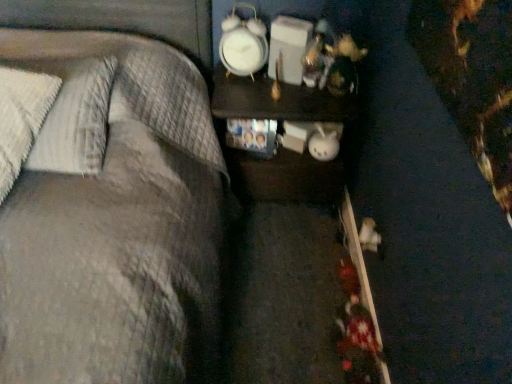
Find the location of a particular element. white plastic clock at upper center is located at coordinates (243, 44).

Image resolution: width=512 pixels, height=384 pixels. What do you see at coordinates (75, 118) in the screenshot? I see `white textured pillow at left` at bounding box center [75, 118].

You are a GUI agent. You are given a task and a screenshot of the screen. Output one action in this format:
    pyautogui.click(x=<x>, y=<y>)
    Task: Click on the white plastic clock at upper center
    
    Given the screenshot: What is the action you would take?
    pyautogui.click(x=243, y=44)

From the picture: Can we say white textured pillow at left lies outside white plastic clock at upper center?

white textured pillow at left lies outside white plastic clock at upper center's area.

Considering the relative sizes of white textured pillow at left and white plastic clock at upper center in the image provided, is white textured pillow at left bigger than white plastic clock at upper center?

Correct, white textured pillow at left is larger in size than white plastic clock at upper center.

I want to click on clock below the white textured pillow at left (from a real-world perspective), so click(243, 44).

Is dark wood nightstand at center further to the viewer compared to white textured pillow at left?

Yes, the depth of dark wood nightstand at center is greater than that of white textured pillow at left.

Can you tell me how much dark wood nightstand at center and white textured pillow at left differ in facing direction?

dark wood nightstand at center and white textured pillow at left are facing 2.61 degrees away from each other.

Between dark wood nightstand at center and white textured pillow at left, which one has less height?

Standing shorter between the two is white textured pillow at left.

Which of these two, dark wood nightstand at center or white textured pillow at left, is wider?

Wider between the two is white textured pillow at left.

Are white plastic clock at upper center and dark wood nightstand at center located far from each other?

white plastic clock at upper center is actually quite close to dark wood nightstand at center.

Based on the photo, is white plastic clock at upper center wider than dark wood nightstand at center?

No, white plastic clock at upper center is not wider than dark wood nightstand at center.

From the picture: From the image's perspective, is white plastic clock at upper center under dark wood nightstand at center?

Incorrect, from the image's perspective, white plastic clock at upper center is higher than dark wood nightstand at center.

Looking at this image, can you tell me how much dark wood nightstand at center and white plastic clock at upper center differ in facing direction?

The facing directions of dark wood nightstand at center and white plastic clock at upper center are 12.1 degrees apart.

Considering the relative sizes of dark wood nightstand at center and white plastic clock at upper center in the image provided, is dark wood nightstand at center shorter than white plastic clock at upper center?

No, dark wood nightstand at center is not shorter than white plastic clock at upper center.

From the image's perspective, would you say dark wood nightstand at center is shown under white plastic clock at upper center?

Correct, dark wood nightstand at center appears lower than white plastic clock at upper center in the image.

Is white plastic clock at upper center to the left of white textured pillow at left from the viewer's perspective?

No.

From a real-world perspective, which object stands above the other?

white textured pillow at left, from a real-world perspective.

Could you tell me if white plastic clock at upper center is facing white textured pillow at left?

No, white plastic clock at upper center is not turned towards white textured pillow at left.

Are white plastic clock at upper center and white textured pillow at left making contact?

No, white plastic clock at upper center is not with white textured pillow at left.

Is white textured pillow at left located outside dark wood nightstand at center?

Yes.

Between white textured pillow at left and dark wood nightstand at center, which one is positioned in front?

white textured pillow at left is more forward.

Can you confirm if white textured pillow at left is bigger than dark wood nightstand at center?

Incorrect, white textured pillow at left is not larger than dark wood nightstand at center.

Between white textured pillow at left and dark wood nightstand at center, which one has larger width?

white textured pillow at left.

There is a white plastic clock at upper center. Where is `pillow above it (from a real-world perspective)`? pillow above it (from a real-world perspective) is located at coordinates (75, 118).

The height and width of the screenshot is (384, 512). I want to click on pillow in front of the dark wood nightstand at center, so click(75, 118).

Estimate the real-world distances between objects in this image. Which object is closer to dark wood nightstand at center, white textured pillow at left or white plastic clock at upper center?

white plastic clock at upper center.

From the image, which object appears to be nearer to white plastic clock at upper center, dark wood nightstand at center or white textured pillow at left?

Among the two, dark wood nightstand at center is located nearer to white plastic clock at upper center.

Which object lies further to the anchor point dark wood nightstand at center, white plastic clock at upper center or white textured pillow at left?

white textured pillow at left is positioned further to the anchor dark wood nightstand at center.

Estimate the real-world distances between objects in this image. Which object is closer to white textured pillow at left, dark wood nightstand at center or white plastic clock at upper center?

Based on the image, dark wood nightstand at center appears to be nearer to white textured pillow at left.

Looking at the image, which one is located further to white plastic clock at upper center, white textured pillow at left or dark wood nightstand at center?

The object further to white plastic clock at upper center is white textured pillow at left.

From the picture: Estimate the real-world distances between objects in this image. Which object is closer to white textured pillow at left, white plastic clock at upper center or dark wood nightstand at center?

dark wood nightstand at center lies closer to white textured pillow at left than the other object.

I want to click on clock between white textured pillow at left and dark wood nightstand at center in the horizontal direction, so click(x=243, y=44).